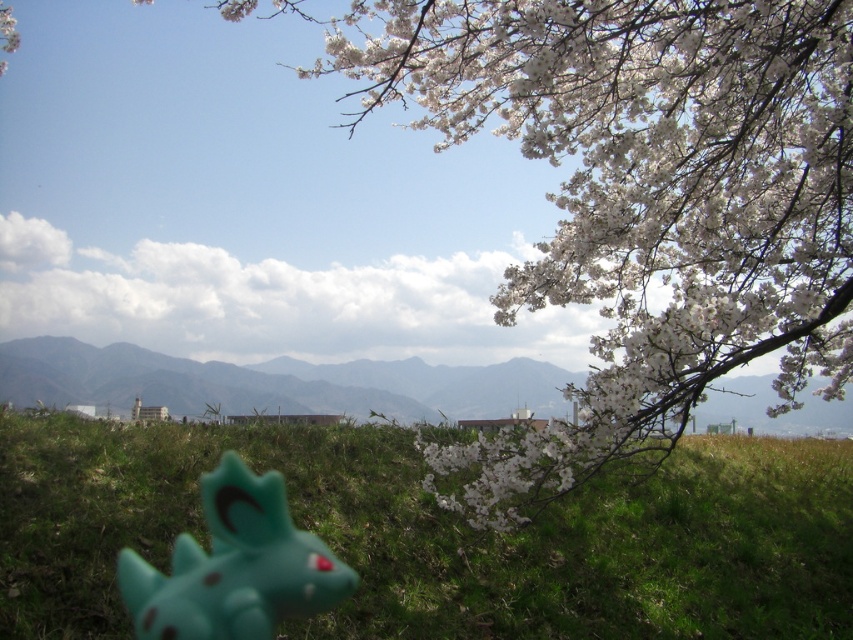
Question: Which point is closer to the camera taking this photo?

Choices:
 (A) (386, 412)
 (B) (212, 588)

Answer: (B)

Question: Based on their relative distances, which object is farther from the teal rubber toy at lower left?

Choices:
 (A) green plastic toy at center
 (B) green grassy at lower center

Answer: (A)

Question: Is green grassy at lower center bigger than teal rubber toy at lower left?

Choices:
 (A) no
 (B) yes

Answer: (A)

Question: Is green grassy at lower center thinner than teal rubber toy at lower left?

Choices:
 (A) no
 (B) yes

Answer: (B)

Question: Estimate the real-world distances between objects in this image. Which object is farther from the green plastic toy at center?

Choices:
 (A) teal rubber toy at lower left
 (B) green grassy at lower center

Answer: (A)

Question: Can you confirm if green grassy at lower center is wider than teal rubber toy at lower left?

Choices:
 (A) yes
 (B) no

Answer: (B)